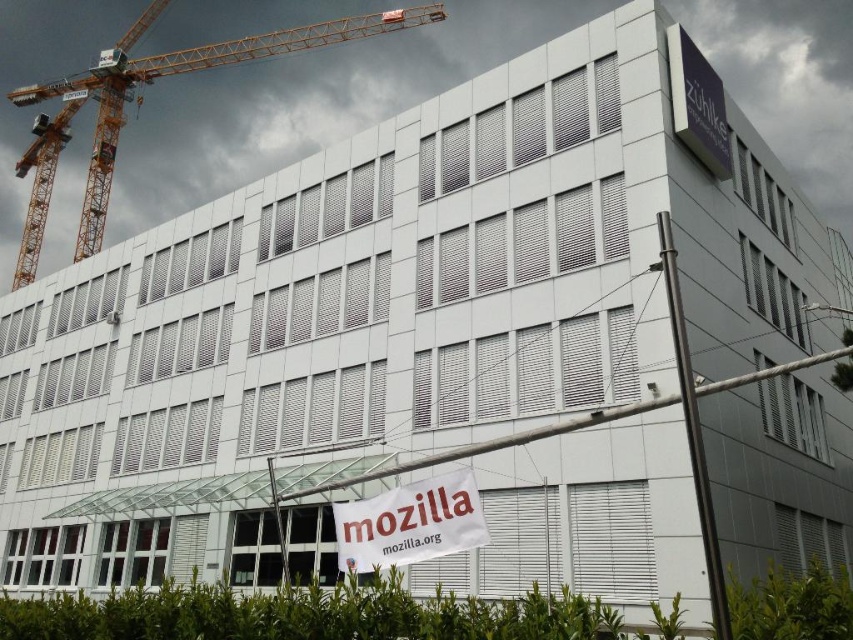
Based on the photo, does yellow metal crane at upper left appear on the left side of white fabric banner at center?

Indeed, yellow metal crane at upper left is positioned on the left side of white fabric banner at center.

Is yellow metal crane at upper left thinner than white fabric banner at center?

No.

This screenshot has height=640, width=853. What do you see at coordinates (140, 104) in the screenshot? I see `yellow metal crane at upper left` at bounding box center [140, 104].

I want to click on yellow metal crane at upper left, so click(140, 104).